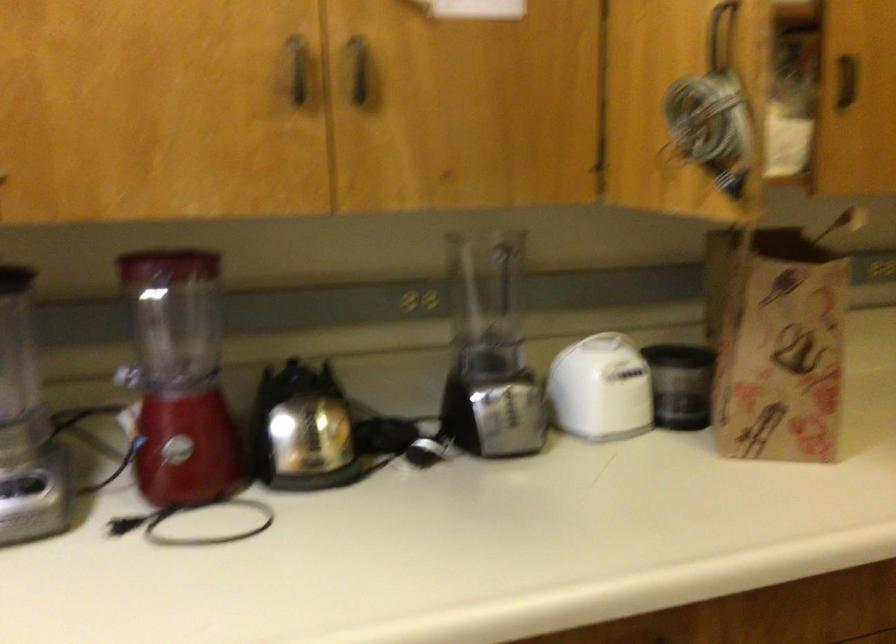
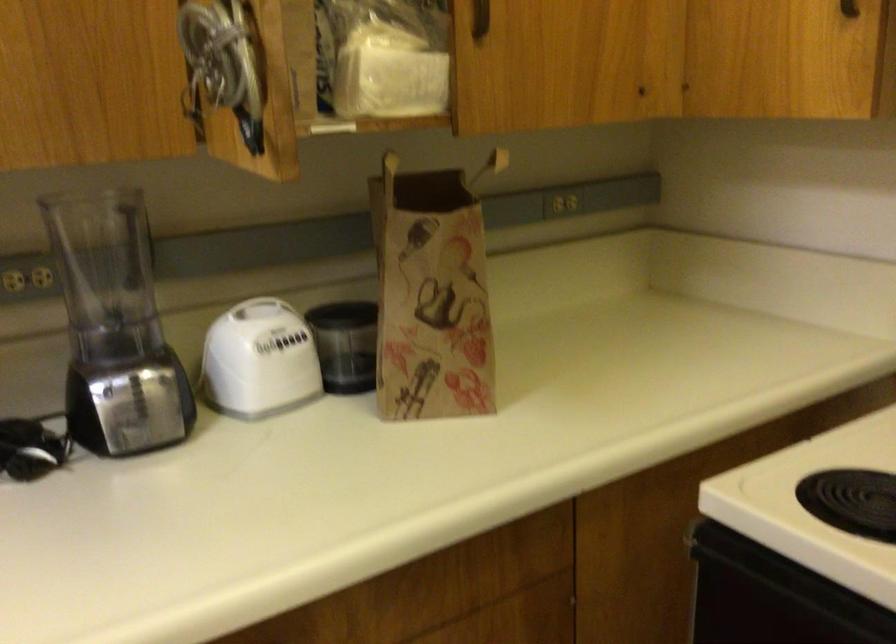
Find the pixel in the second image that matches pixel 812 225 in the first image.

(489, 166)